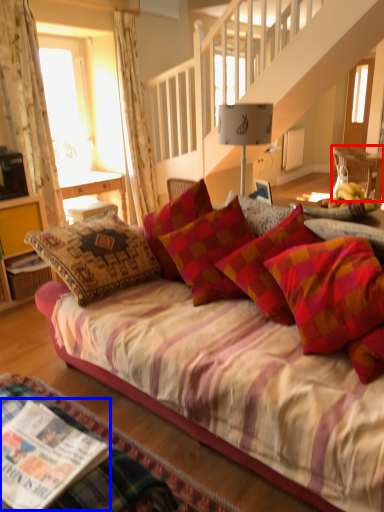
Question: Which object is closer to the camera taking this photo, chair (highlighted by a red box) or magazine (highlighted by a blue box)?

Choices:
 (A) chair
 (B) magazine

Answer: (B)